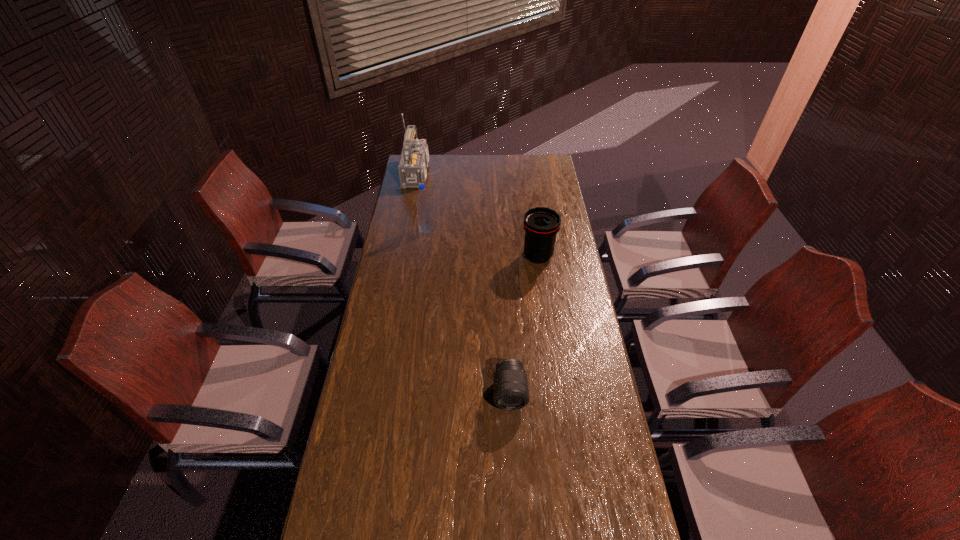
At what (x,y) coordinates should I click in order to perform the action: click on empty space between the radio receiver and the rightmost object. Please return your answer as a coordinate pair (x, y). Image resolution: width=960 pixels, height=540 pixels. Looking at the image, I should click on (479, 215).

Locate an element on the screen. free space between the shortest object and the tallest object is located at coordinates (465, 283).

Where is `free spot between the left telephoto lens and the rightmost object`? The width and height of the screenshot is (960, 540). free spot between the left telephoto lens and the rightmost object is located at coordinates (524, 324).

Image resolution: width=960 pixels, height=540 pixels. I want to click on free space between the shortest object and the third nearest object, so click(468, 311).

In order to click on vacant area that lies between the second farthest object and the second object from right to left in this screenshot , I will do `click(468, 311)`.

Locate which object ranks third in proximity to the radio receiver. Please provide its 2D coordinates. Your answer should be formatted as a tuple, i.e. [(x, y)], where the tuple contains the x and y coordinates of a point satisfying the conditions above.

[(510, 385)]

I want to click on object that stands as the second closest to the radio receiver, so click(x=541, y=224).